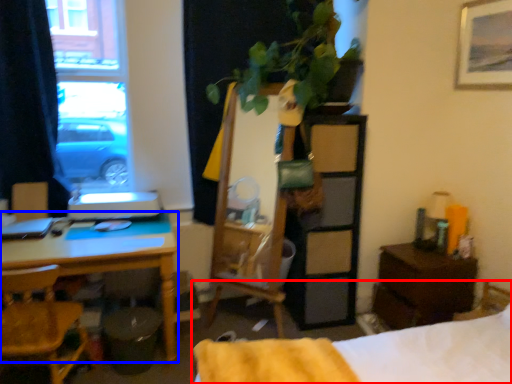
Question: Among these objects, which one is farthest to the camera, bed (highlighted by a red box) or desk (highlighted by a blue box)?

Choices:
 (A) bed
 (B) desk

Answer: (B)